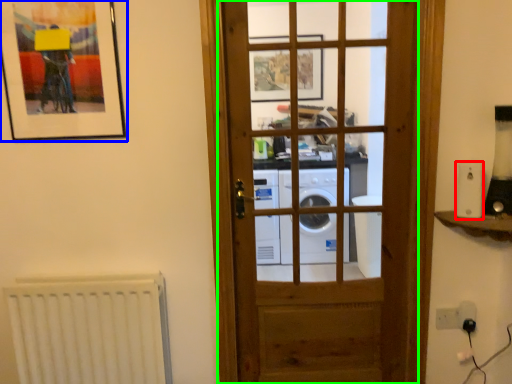
Question: Based on their relative distances, which object is nearer to appliance (highlighted by a red box)? Choose from picture frame (highlighted by a blue box) and door (highlighted by a green box).

Choices:
 (A) picture frame
 (B) door

Answer: (B)